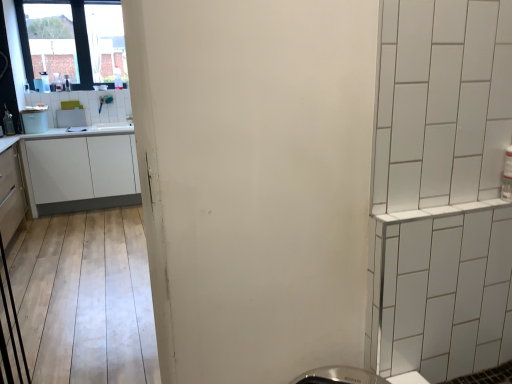
You are a GUI agent. You are given a task and a screenshot of the screen. Output one action in this format:
    pyautogui.click(x=<x>, y=<y>)
    Task: Click on the free point in front of white matte cabinet at left, the second cabinetry viewed from the front
    
    Given the screenshot: What is the action you would take?
    pyautogui.click(x=80, y=220)